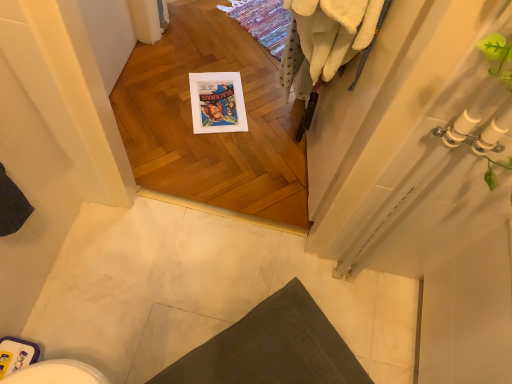
Question: Is white fluffy bath towel at upper right to the left or to the right of dark gray fabric bath mat at lower center in the image?

Choices:
 (A) right
 (B) left

Answer: (A)

Question: Considering their positions, is white fluffy bath towel at upper right located in front of or behind dark gray fabric bath mat at lower center?

Choices:
 (A) front
 (B) behind

Answer: (A)

Question: From the image's perspective, relative to dark gray fabric bath mat at lower center, is white fluffy bath towel at upper right above or below?

Choices:
 (A) above
 (B) below

Answer: (A)

Question: Considering the positions of dark gray fabric bath mat at lower center and white fluffy bath towel at upper right in the image, is dark gray fabric bath mat at lower center taller or shorter than white fluffy bath towel at upper right?

Choices:
 (A) short
 (B) tall

Answer: (A)

Question: Looking at the image, does dark gray fabric bath mat at lower center seem bigger or smaller compared to white fluffy bath towel at upper right?

Choices:
 (A) small
 (B) big

Answer: (A)

Question: From the image's perspective, is dark gray fabric bath mat at lower center positioned above or below white fluffy bath towel at upper right?

Choices:
 (A) below
 (B) above

Answer: (A)

Question: Is point (189, 375) closer or farther from the camera than point (286, 56)?

Choices:
 (A) farther
 (B) closer

Answer: (B)